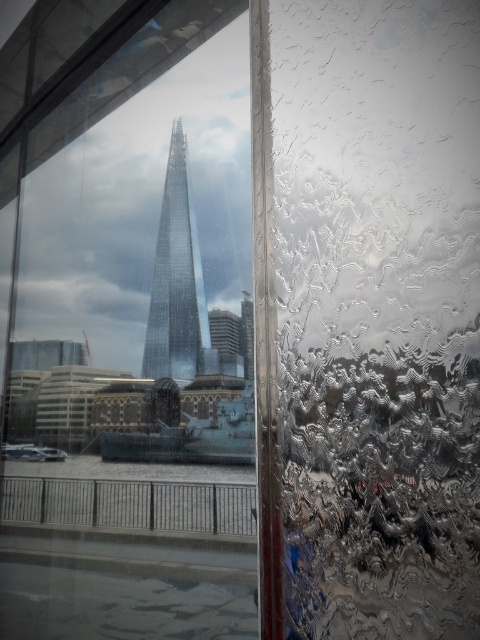
Which is above, transparent glass window at center or transparent glass tower at center?

Positioned higher is transparent glass tower at center.

Looking at this image, is transparent glass window at center to the left of transparent glass tower at center from the viewer's perspective?

Yes, transparent glass window at center is to the left of transparent glass tower at center.

This screenshot has height=640, width=480. Find the location of `transparent glass window at center`. transparent glass window at center is located at coordinates (132, 344).

You are a GUI agent. You are given a task and a screenshot of the screen. Output one action in this format:
    pyautogui.click(x=<x>, y=<y>)
    Task: Click on the transparent glass window at center
    The height and width of the screenshot is (640, 480).
    Given the screenshot: What is the action you would take?
    pyautogui.click(x=132, y=344)